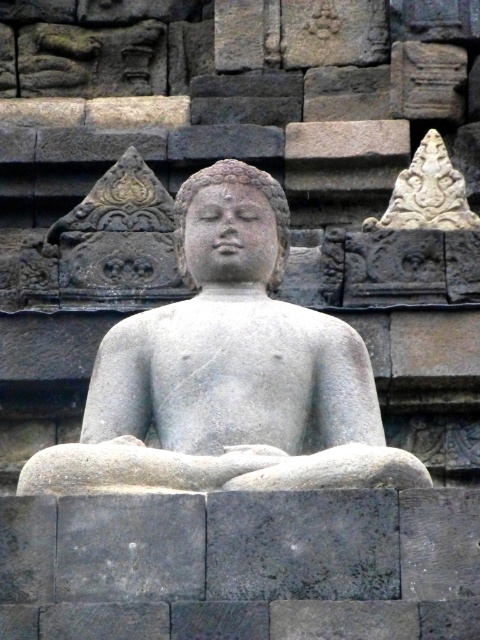
Question: Which object is positioned farthest from the gray stone head at center?

Choices:
 (A) carved stone ornament at upper center
 (B) gray stone statue at center

Answer: (A)

Question: Which point is closer to the camera?

Choices:
 (A) (135, 355)
 (B) (447, 221)

Answer: (A)

Question: Is gray stone statue at center bigger than gray stone head at center?

Choices:
 (A) yes
 (B) no

Answer: (A)

Question: Does carved stone ornament at upper center come behind gray stone head at center?

Choices:
 (A) yes
 (B) no

Answer: (A)

Question: Does gray stone statue at center have a greater width compared to gray stone head at center?

Choices:
 (A) yes
 (B) no

Answer: (A)

Question: Which object is closer to the camera taking this photo?

Choices:
 (A) carved stone ornament at upper center
 (B) gray stone head at center
 (C) gray stone statue at center

Answer: (C)